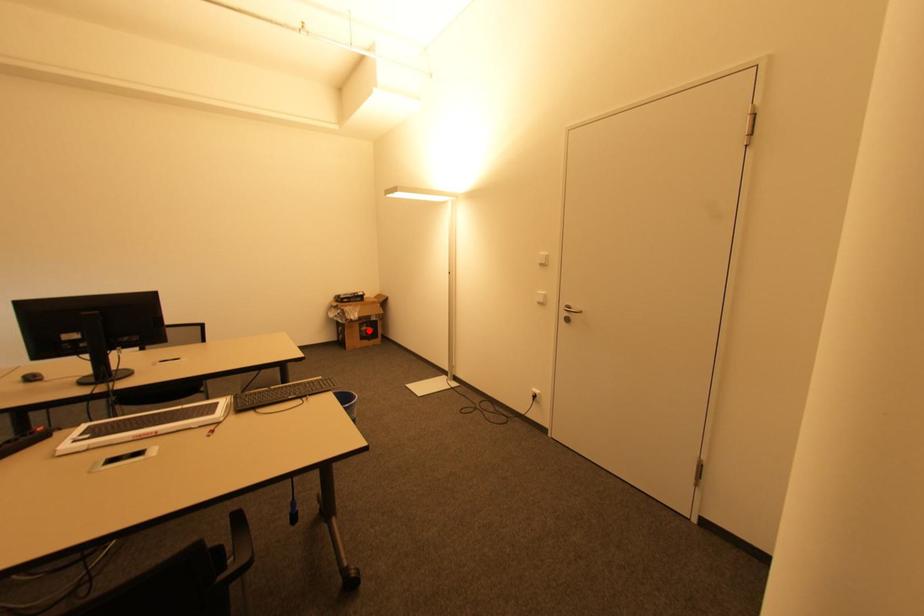
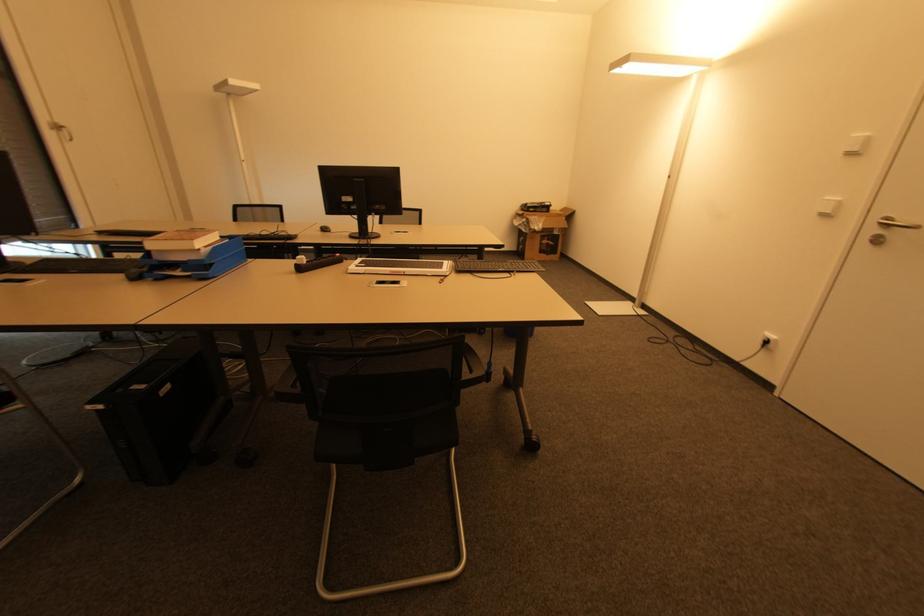
Question: I am providing you with two images of the same scene from different viewpoints. Given a red point in image1, look at the same physical point in image2. Is it:

Choices:
 (A) Closer to the viewpoint
 (B) Farther from the viewpoint

Answer: (A)